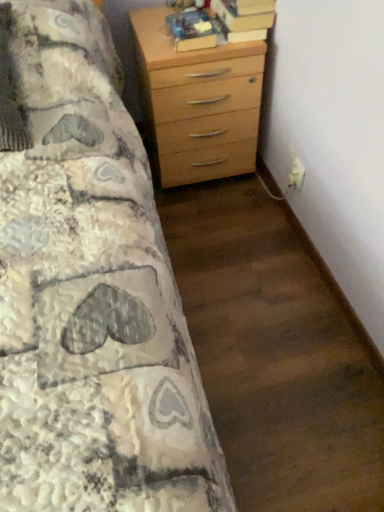
Identify the location of vacant area that is in front of light wood chest of drawers at upper right. (222, 221).